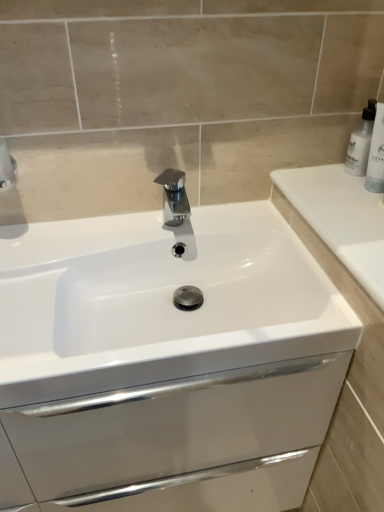
Question: Is white plastic bottle at upper right a part of polished chrome tap at center?

Choices:
 (A) no
 (B) yes

Answer: (A)

Question: Is there a large distance between polished chrome tap at center and white plastic bottle at upper right?

Choices:
 (A) yes
 (B) no

Answer: (B)

Question: Considering the relative sizes of polished chrome tap at center and white plastic bottle at upper right in the image provided, is polished chrome tap at center wider than white plastic bottle at upper right?

Choices:
 (A) no
 (B) yes

Answer: (B)

Question: Is polished chrome tap at center at the left side of white plastic bottle at upper right?

Choices:
 (A) no
 (B) yes

Answer: (B)

Question: Can we say polished chrome tap at center lies outside white plastic bottle at upper right?

Choices:
 (A) yes
 (B) no

Answer: (A)

Question: Can you confirm if polished chrome tap at center is thinner than white plastic bottle at upper right?

Choices:
 (A) yes
 (B) no

Answer: (B)

Question: Is polished chrome tap at center not within white glossy sink at center?

Choices:
 (A) no
 (B) yes

Answer: (B)

Question: Considering the relative sizes of polished chrome tap at center and white glossy sink at center in the image provided, is polished chrome tap at center bigger than white glossy sink at center?

Choices:
 (A) yes
 (B) no

Answer: (B)

Question: Are polished chrome tap at center and white glossy sink at center located far from each other?

Choices:
 (A) no
 (B) yes

Answer: (A)

Question: Does polished chrome tap at center have a greater width compared to white glossy sink at center?

Choices:
 (A) no
 (B) yes

Answer: (A)

Question: From the image's perspective, is polished chrome tap at center located beneath white glossy sink at center?

Choices:
 (A) no
 (B) yes

Answer: (A)

Question: Is polished chrome tap at center at the right side of white glossy sink at center?

Choices:
 (A) yes
 (B) no

Answer: (A)

Question: Is white glossy sink at center shorter than white glossy bottle at upper right?

Choices:
 (A) yes
 (B) no

Answer: (A)